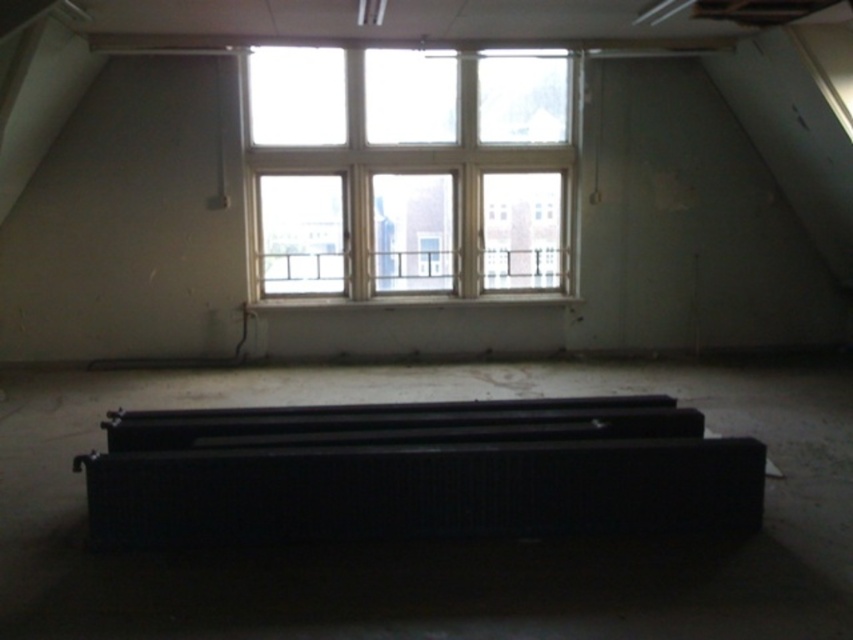
Can you confirm if black matte radiator at center is positioned to the left of clear glass window at upper center?

No, black matte radiator at center is not to the left of clear glass window at upper center.

Does black matte radiator at center have a lesser width compared to clear glass window at upper center?

Incorrect, black matte radiator at center's width is not less than clear glass window at upper center's.

Locate an element on the screen. This screenshot has height=640, width=853. black matte radiator at center is located at coordinates (418, 472).